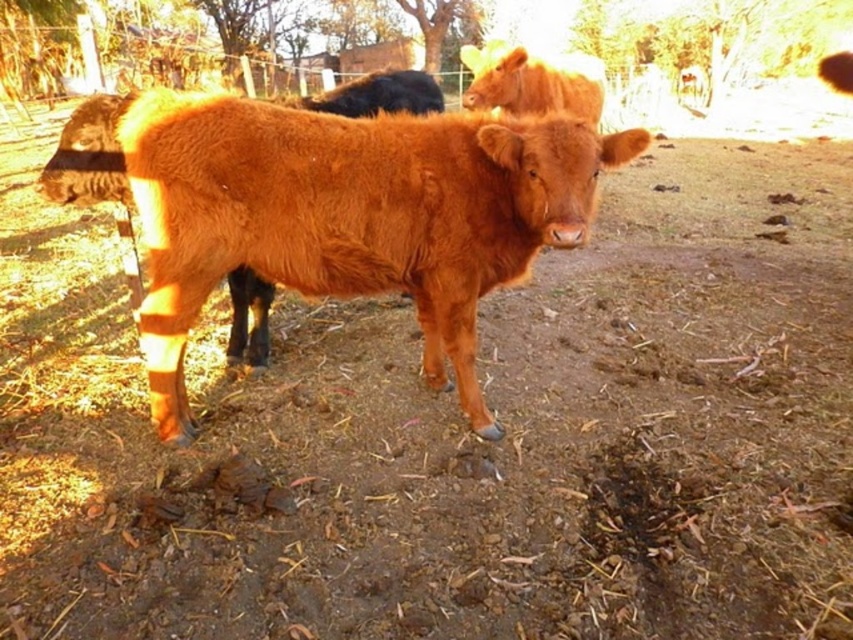
You are a farmer checking the herd and notice two bulls in the image. The brown woolly bull at center and the shiny brown bull at upper center. Which bull is located higher in the image?

The shiny brown bull at upper center is higher in the image because the brown woolly bull at center is positioned under it.